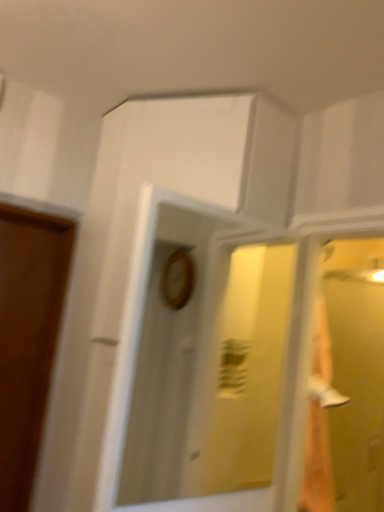
Question: From the image's perspective, is transparent glass door at right located beneath wooden clock at center?

Choices:
 (A) yes
 (B) no

Answer: (A)

Question: Does transparent glass door at right appear on the right side of wooden clock at center?

Choices:
 (A) yes
 (B) no

Answer: (A)

Question: Considering the relative sizes of transparent glass door at right and wooden clock at center in the image provided, is transparent glass door at right bigger than wooden clock at center?

Choices:
 (A) no
 (B) yes

Answer: (B)

Question: Considering the relative sizes of transparent glass door at right and wooden clock at center in the image provided, is transparent glass door at right thinner than wooden clock at center?

Choices:
 (A) no
 (B) yes

Answer: (A)

Question: Does transparent glass door at right have a smaller size compared to wooden clock at center?

Choices:
 (A) yes
 (B) no

Answer: (B)

Question: Is transparent glass door at right further to the viewer compared to wooden clock at center?

Choices:
 (A) no
 (B) yes

Answer: (B)

Question: From a real-world perspective, is wooden clock at center under transparent glass door at right?

Choices:
 (A) no
 (B) yes

Answer: (A)

Question: Is wooden clock at center not near transparent glass door at right?

Choices:
 (A) yes
 (B) no

Answer: (B)

Question: From the image's perspective, is wooden clock at center above transparent glass door at right?

Choices:
 (A) no
 (B) yes

Answer: (B)

Question: Does wooden clock at center appear on the right side of transparent glass door at right?

Choices:
 (A) no
 (B) yes

Answer: (A)

Question: Is wooden clock at center turned away from transparent glass door at right?

Choices:
 (A) no
 (B) yes

Answer: (A)

Question: Is wooden clock at center thinner than transparent glass door at right?

Choices:
 (A) no
 (B) yes

Answer: (B)

Question: Considering the positions of transparent glass door at right and wooden clock at center in the image, is transparent glass door at right taller or shorter than wooden clock at center?

Choices:
 (A) tall
 (B) short

Answer: (A)